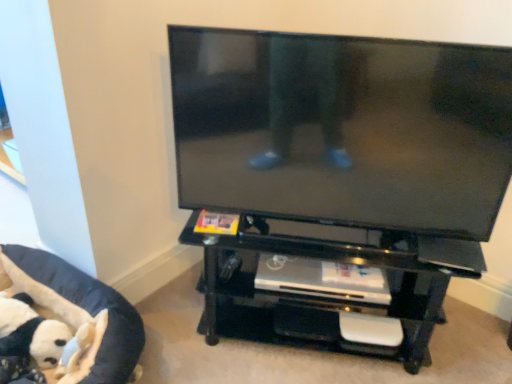
Question: Considering the relative sizes of black glossy flat-screen tv at center and black fabric pet bed at lower left in the image provided, is black glossy flat-screen tv at center wider than black fabric pet bed at lower left?

Choices:
 (A) yes
 (B) no

Answer: (B)

Question: From the image's perspective, is black glossy flat-screen tv at center over black fabric pet bed at lower left?

Choices:
 (A) no
 (B) yes

Answer: (B)

Question: Is black glossy flat-screen tv at center not within black fabric pet bed at lower left?

Choices:
 (A) yes
 (B) no

Answer: (A)

Question: From a real-world perspective, does black glossy flat-screen tv at center stand above black fabric pet bed at lower left?

Choices:
 (A) yes
 (B) no

Answer: (A)

Question: Does black glossy flat-screen tv at center lie behind black fabric pet bed at lower left?

Choices:
 (A) no
 (B) yes

Answer: (A)

Question: From the image's perspective, relative to black fabric pet bed at lower left, is black glossy flat-screen tv at center above or below?

Choices:
 (A) above
 (B) below

Answer: (A)

Question: In terms of width, does black glossy flat-screen tv at center look wider or thinner when compared to black fabric pet bed at lower left?

Choices:
 (A) wide
 (B) thin

Answer: (B)

Question: Is black glossy flat-screen tv at center bigger or smaller than black fabric pet bed at lower left?

Choices:
 (A) big
 (B) small

Answer: (A)

Question: Is black glossy flat-screen tv at center in front of or behind black fabric pet bed at lower left in the image?

Choices:
 (A) front
 (B) behind

Answer: (A)

Question: From a real-world perspective, is black glossy flat-screen tv at center physically located above or below black glossy entertainment center at center?

Choices:
 (A) below
 (B) above

Answer: (B)

Question: Is black glossy flat-screen tv at center wider or thinner than black glossy entertainment center at center?

Choices:
 (A) thin
 (B) wide

Answer: (A)

Question: Is point (431, 183) positioned closer to the camera than point (224, 274)?

Choices:
 (A) farther
 (B) closer

Answer: (B)

Question: Is black glossy flat-screen tv at center in front of or behind black glossy entertainment center at center in the image?

Choices:
 (A) behind
 (B) front

Answer: (B)

Question: Choose the correct answer: Is black fabric pet bed at lower left inside black glossy entertainment center at center or outside it?

Choices:
 (A) inside
 (B) outside

Answer: (B)

Question: Considering their positions, is black fabric pet bed at lower left located in front of or behind black glossy entertainment center at center?

Choices:
 (A) behind
 (B) front

Answer: (B)